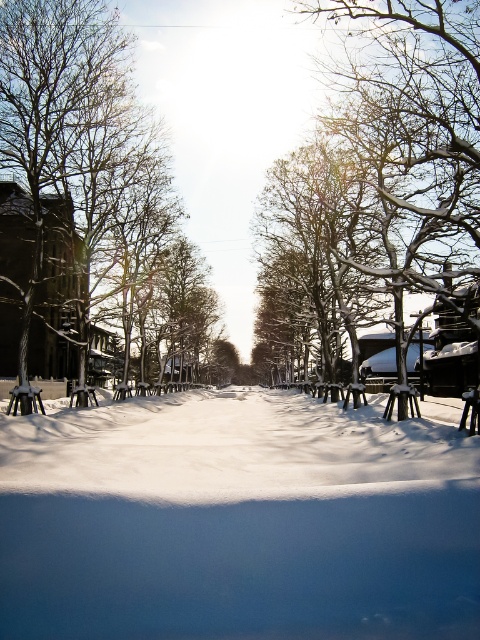
Question: Is white powdery snow at center to the left of snow-covered tree at center from the viewer's perspective?

Choices:
 (A) no
 (B) yes

Answer: (B)

Question: Which point is farther from the camera taking this photo?

Choices:
 (A) (410, 116)
 (B) (64, 74)

Answer: (B)

Question: Considering the real-world distances, which object is closest to the snow-covered tree at left?

Choices:
 (A) snow-covered tree at center
 (B) white powdery snow at center
 (C) snow-covered tree at upper right

Answer: (B)

Question: Is white powdery snow at center positioned at the back of snow-covered tree at center?

Choices:
 (A) no
 (B) yes

Answer: (A)

Question: Is white powdery snow at center bigger than snow-covered tree at left?

Choices:
 (A) yes
 (B) no

Answer: (B)

Question: Which object appears closest to the camera in this image?

Choices:
 (A) snow-covered tree at center
 (B) white powdery snow at center
 (C) snow-covered tree at upper right

Answer: (B)